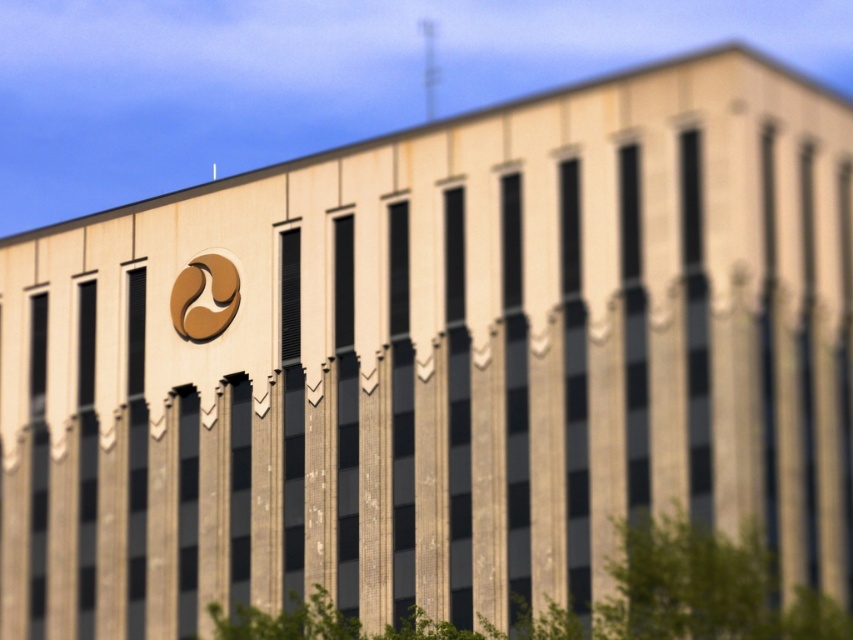
Question: Does green leafy tree at lower center appear on the left side of gold metallic logo at upper center?

Choices:
 (A) yes
 (B) no

Answer: (B)

Question: Which point is closer to the camera?

Choices:
 (A) gold metallic logo at upper center
 (B) green leafy tree at lower center

Answer: (B)

Question: Which object appears closest to the camera in this image?

Choices:
 (A) gold metallic logo at upper center
 (B) green leafy tree at lower center

Answer: (B)

Question: Is green leafy tree at lower center above gold metallic logo at upper center?

Choices:
 (A) yes
 (B) no

Answer: (B)

Question: Does green leafy tree at lower center appear over gold metallic logo at upper center?

Choices:
 (A) yes
 (B) no

Answer: (B)